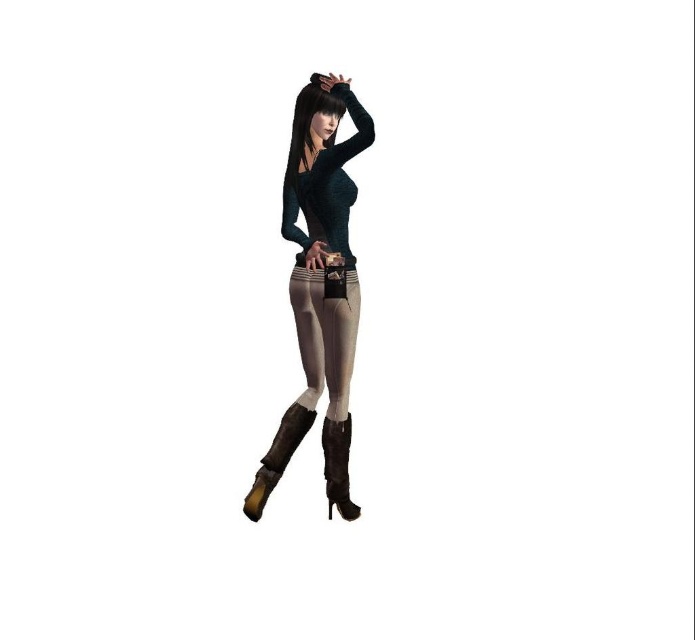
You are an artist trying to draw the character in the image. You want to ensure that the two points, point (304, 132) and point (256, 506), are placed correctly in terms of depth. Which point should you draw closer to the viewer?

Point (304, 132) is closer to the viewer than point (256, 506), so you should draw point (304, 132) closer to the viewer.

Looking at this image, you are standing in front of a 3D character model. You notice a point at coordinates point [270,465]. Given that the distance between this point and you is 13.69 feet, can you estimate how far you are from the character?

The distance between point [270,465] and the viewer is 13.69 feet. Since the point is part of the character, this distance is the same as the distance between you and the character. Therefore, you are 13.69 feet away from the character.